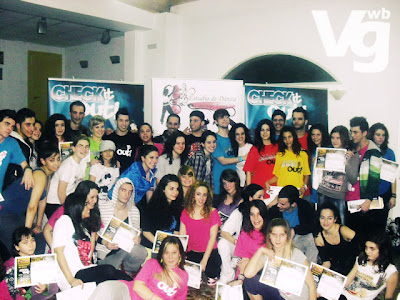
The width and height of the screenshot is (400, 300). I want to click on archway, so click(258, 72).